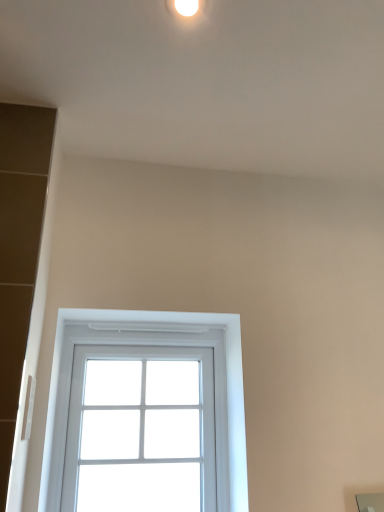
The image size is (384, 512). Describe the element at coordinates (153, 344) in the screenshot. I see `white plastic window at lower center` at that location.

Where is `white plastic window at lower center`? white plastic window at lower center is located at coordinates (153, 344).

In order to face white plastic window at lower center, should I rotate leftwards or rightwards?

Rotate left and turn 6.670 degrees.

Find the location of a particular element. The height and width of the screenshot is (512, 384). white plastic window at lower center is located at coordinates (153, 344).